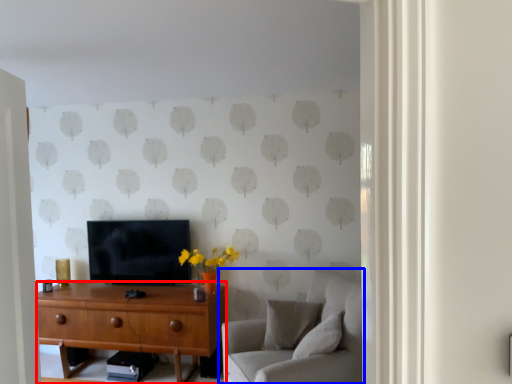
Question: Which of the following is the farthest to the observer, desk (highlighted by a red box) or studio couch (highlighted by a blue box)?

Choices:
 (A) desk
 (B) studio couch

Answer: (A)